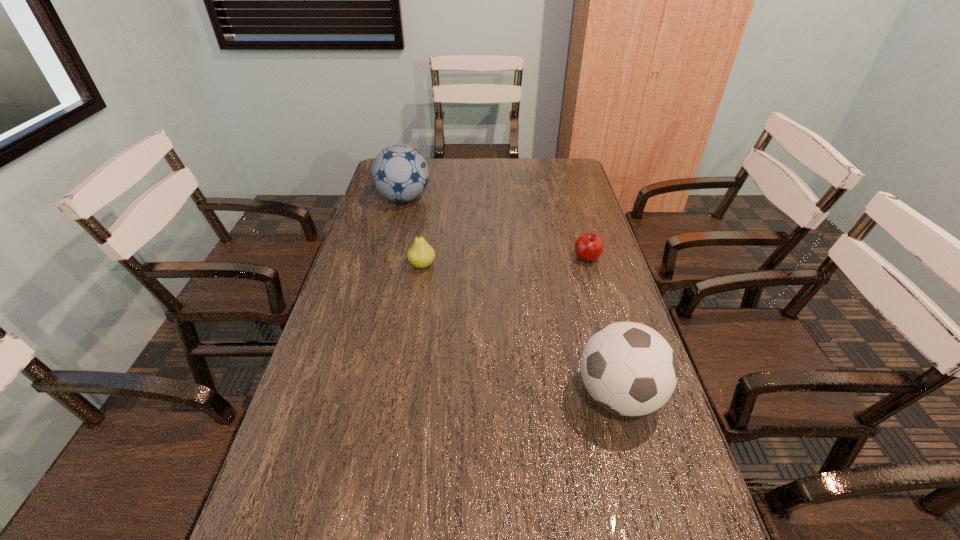
This screenshot has height=540, width=960. What are the coordinates of `unoccupied area between the pear and the farthest object` in the screenshot? It's located at (413, 232).

Find the location of `unoccupied position between the farther soccer ball and the pear`. unoccupied position between the farther soccer ball and the pear is located at coordinates (413, 232).

Image resolution: width=960 pixels, height=540 pixels. What are the coordinates of `free space between the nearer soccer ball and the second shortest object` in the screenshot? It's located at (520, 330).

This screenshot has width=960, height=540. Find the location of `vacant area between the right soccer ball and the farther soccer ball`. vacant area between the right soccer ball and the farther soccer ball is located at coordinates (511, 296).

This screenshot has height=540, width=960. Find the location of `free area in between the left soccer ball and the right soccer ball`. free area in between the left soccer ball and the right soccer ball is located at coordinates (511, 296).

Identify the location of free space between the apple and the right soccer ball. This screenshot has height=540, width=960. (603, 326).

You are a GUI agent. You are given a task and a screenshot of the screen. Output one action in this format:
    pyautogui.click(x=<x>, y=<y>)
    Task: Click on the free space between the right soccer ball and the left soccer ball
    
    Given the screenshot: What is the action you would take?
    pyautogui.click(x=511, y=296)

The width and height of the screenshot is (960, 540). In order to click on free space between the second shortest object and the right soccer ball in this screenshot , I will do `click(520, 330)`.

You are a GUI agent. You are given a task and a screenshot of the screen. Output one action in this format:
    pyautogui.click(x=<x>, y=<y>)
    Task: Click on the object identified as the second closest to the pear
    The image size is (960, 540).
    Given the screenshot: What is the action you would take?
    pyautogui.click(x=588, y=247)

Select which object appears as the closest to the right soccer ball. Please provide its 2D coordinates. Your answer should be formatted as a tuple, i.e. [(x, y)], where the tuple contains the x and y coordinates of a point satisfying the conditions above.

[(588, 247)]